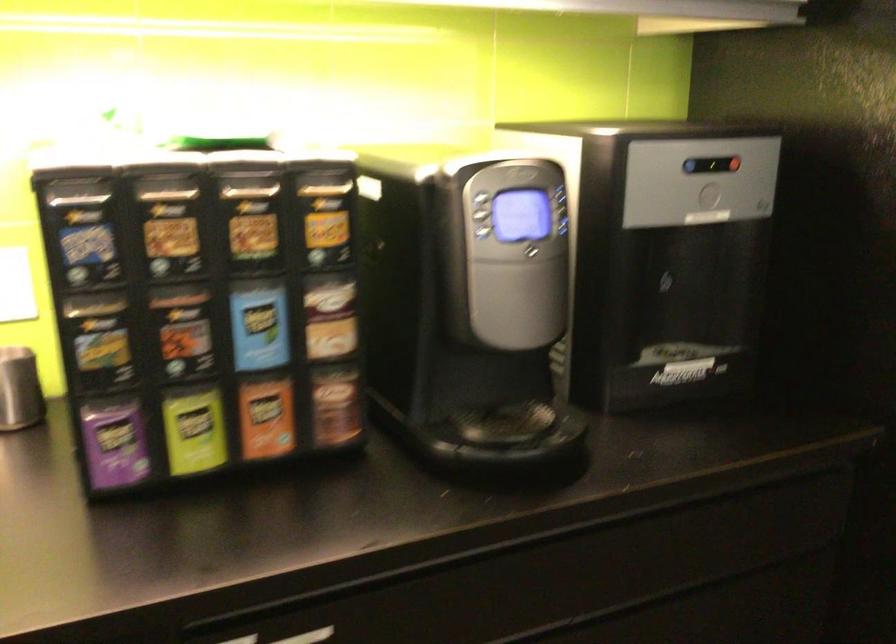
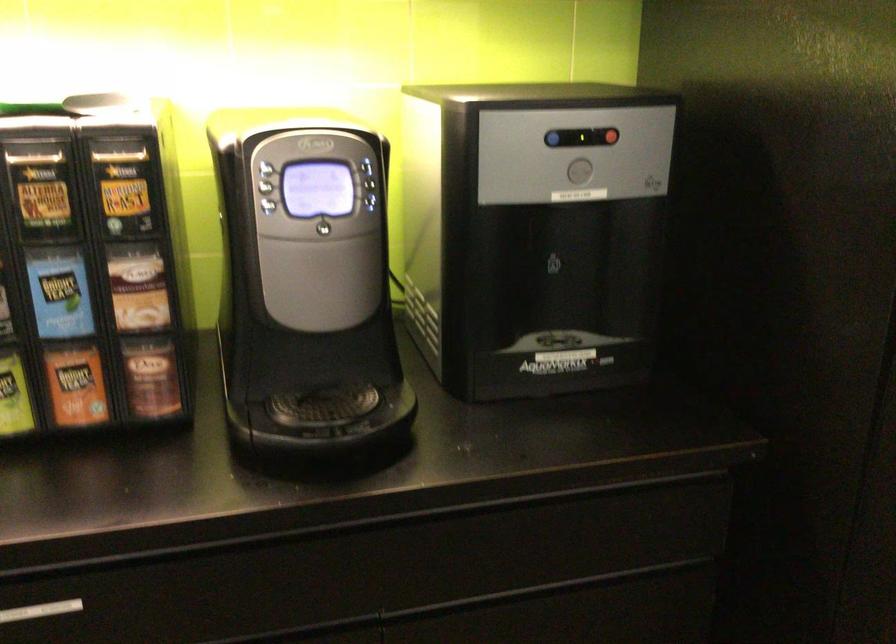
Locate, in the second image, the point that corresponds to (x=734, y=162) in the first image.

(612, 136)